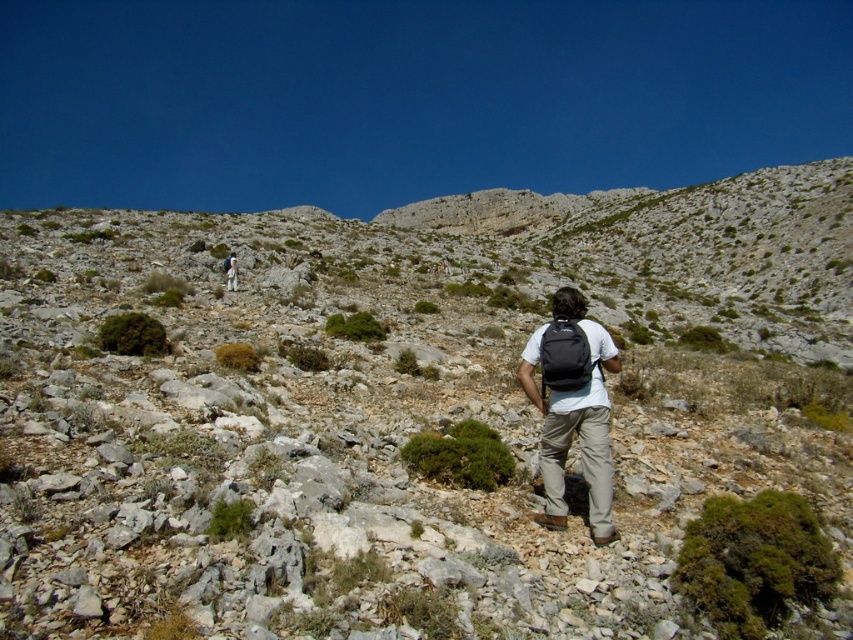
Does point (762, 568) come closer to viewer compared to point (363, 314)?

Yes, point (762, 568) is in front of point (363, 314).

Is green mossy bush at lower right closer to the viewer compared to green mossy shrub at center?

Yes.

Find the location of a particular element. green mossy bush at lower right is located at coordinates (753, 561).

Where is `green mossy bush at lower right`? This screenshot has height=640, width=853. green mossy bush at lower right is located at coordinates (753, 561).

Who is more distant from viewer, (764, 566) or (109, 348)?

The point (109, 348) is more distant.

This screenshot has width=853, height=640. Identify the location of green mossy bush at lower right. (753, 561).

Where is `green mossy bush at lower right`? This screenshot has width=853, height=640. green mossy bush at lower right is located at coordinates (753, 561).

Is matte black backpack at center closer to camera compared to green shrub at center?

Yes, matte black backpack at center is in front of green shrub at center.

Can you confirm if matte black backpack at center is bigger than green shrub at center?

Correct, matte black backpack at center is larger in size than green shrub at center.

The image size is (853, 640). In order to click on matte black backpack at center in this screenshot , I will do `click(572, 406)`.